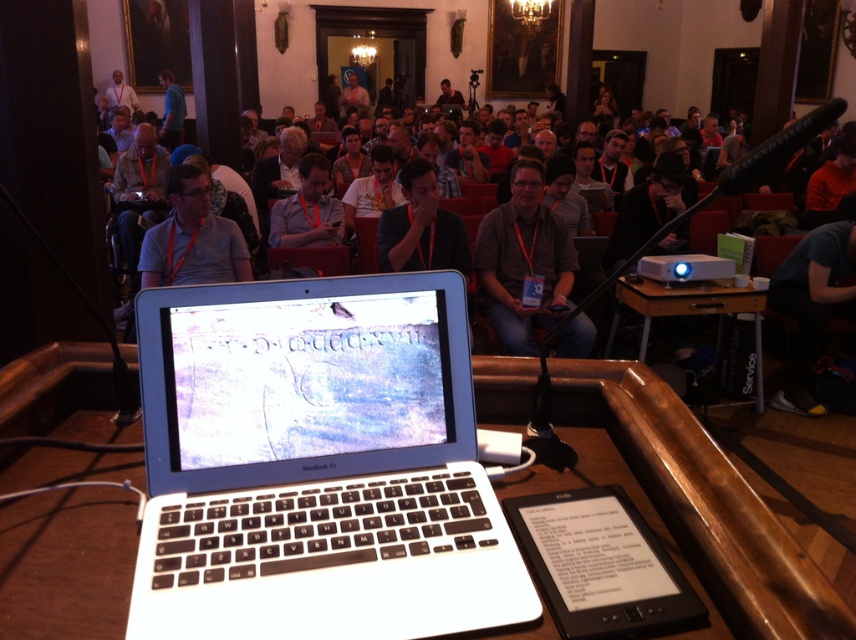
Question: Can you confirm if matte gray shirt at center is wider than matte black laptop at center?

Choices:
 (A) no
 (B) yes

Answer: (B)

Question: Which point is farther to the camera?

Choices:
 (A) wooden table at right
 (B) matte gray shirt at center

Answer: (A)

Question: Observing the image, what is the correct spatial positioning of white plastic laptop at center in reference to matte black shirt at center?

Choices:
 (A) right
 (B) left

Answer: (B)

Question: Which point appears farthest from the camera in this image?

Choices:
 (A) (187, 401)
 (B) (684, 314)
 (C) (474, 128)

Answer: (C)

Question: Which point is farther to the camera?

Choices:
 (A) matte black shirt at center
 (B) matte black laptop at center

Answer: (B)

Question: Observing the image, what is the correct spatial positioning of matte gray shirt at center in reference to wooden table at right?

Choices:
 (A) above
 (B) below

Answer: (A)